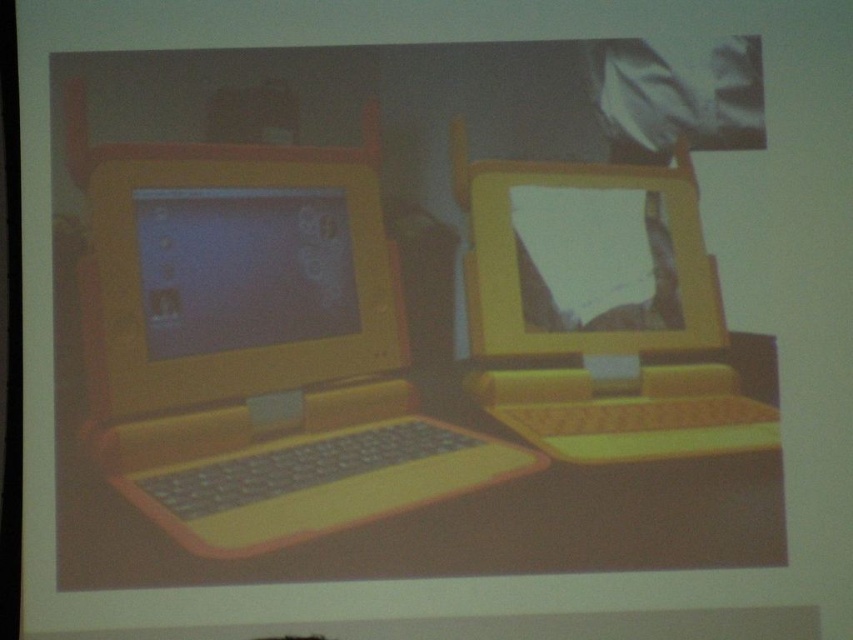
Question: Does yellow matte laptop at left have a lesser width compared to yellow plastic laptop at center?

Choices:
 (A) yes
 (B) no

Answer: (B)

Question: Which point appears closest to the camera in this image?

Choices:
 (A) (215, 506)
 (B) (517, 296)
 (C) (755, 404)
 (D) (473, 570)

Answer: (A)

Question: Which object appears farthest from the camera in this image?

Choices:
 (A) yellow plastic monitor at center
 (B) yellow plastic table at center
 (C) yellow matte laptop at left

Answer: (A)

Question: Is yellow plastic table at center above yellow plastic laptop at center?

Choices:
 (A) yes
 (B) no

Answer: (B)

Question: Which point is closer to the camera?

Choices:
 (A) (296, 500)
 (B) (480, 413)
 (C) (692, 321)

Answer: (A)

Question: Can you confirm if yellow plastic table at center is smaller than yellow plastic monitor at center?

Choices:
 (A) no
 (B) yes

Answer: (A)